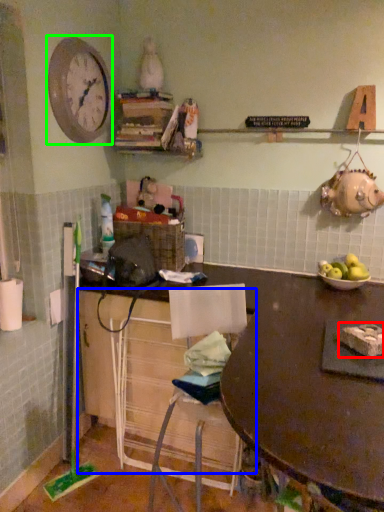
Question: Which object is positioned closest to food (highlighted by a red box)? Select from cabinetry (highlighted by a blue box) and clock (highlighted by a green box).

Choices:
 (A) cabinetry
 (B) clock

Answer: (A)